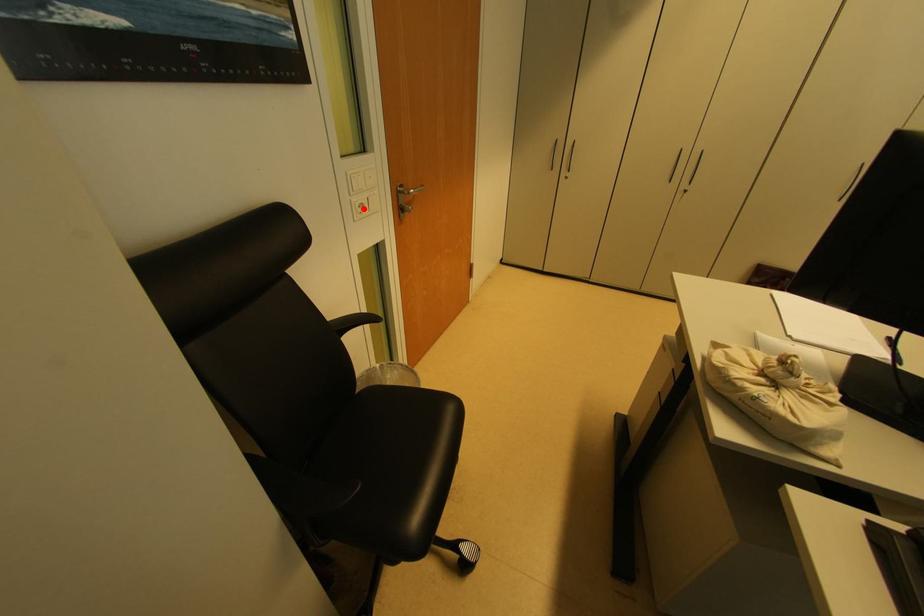
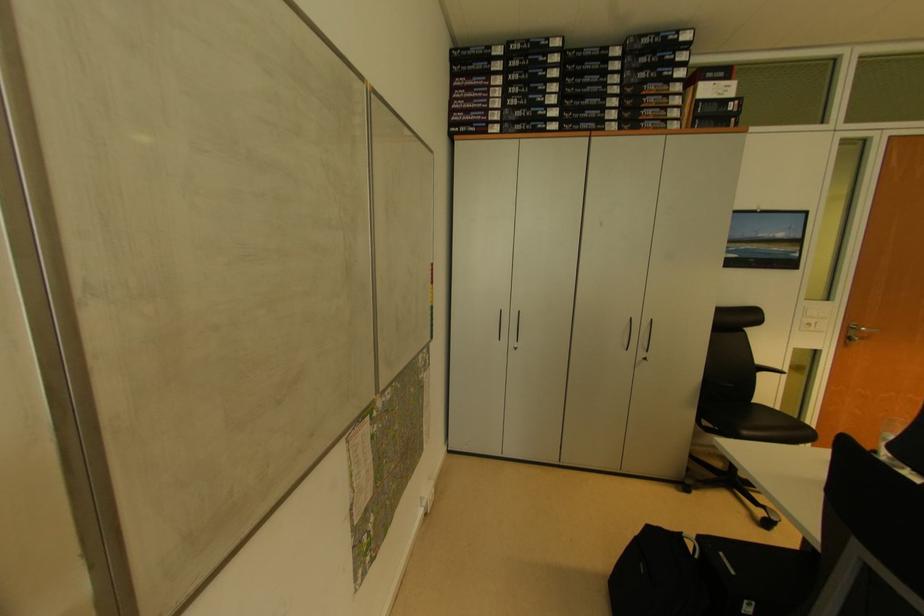
Where in the second image is the point corresponding to the highlighted location from the first image?

(811, 328)